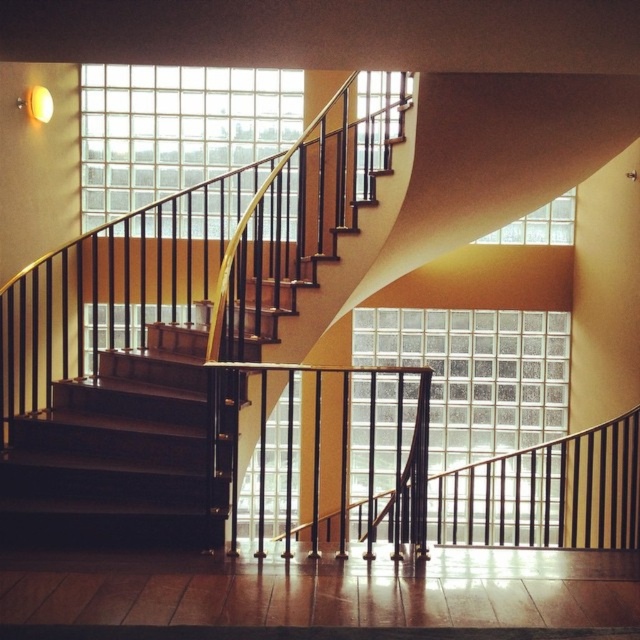
You are a delivery person carrying a large package and need to navigate through the clear glass wall at upper center and the clear glass wall at center. Which glass wall should you avoid walking into?

You should avoid walking into the clear glass wall at upper center because it is located above the clear glass wall at center, making it higher and potentially more dangerous to collide with.

You are standing in the interior space and want to know if you can safely walk towards the clear glass wall at center without any obstacles. Can you confirm if there are any objects blocking your path?

The clear glass wall at center is 7.30 meters away from the viewer, so there are no objects blocking the path as the staircase and other elements are positioned around it, allowing a clear walkway.

Looking at this image, you are standing in the interior space and want to know how far you are from the clear glass wall at upper center. Can you determine the distance?

The clear glass wall at upper center is 7.15 meters away from the viewer, so you are 7.15 meters away from it.